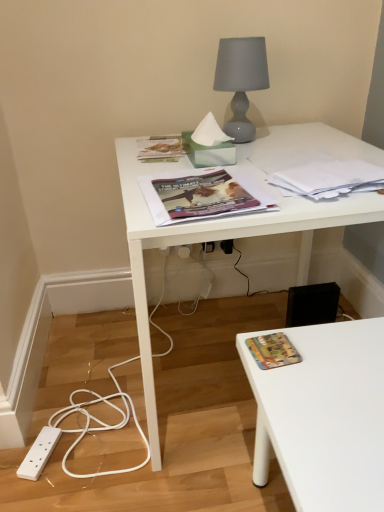
This screenshot has height=512, width=384. I want to click on spots to the right of white plastic power plugs and sockets at lower left, so click(100, 451).